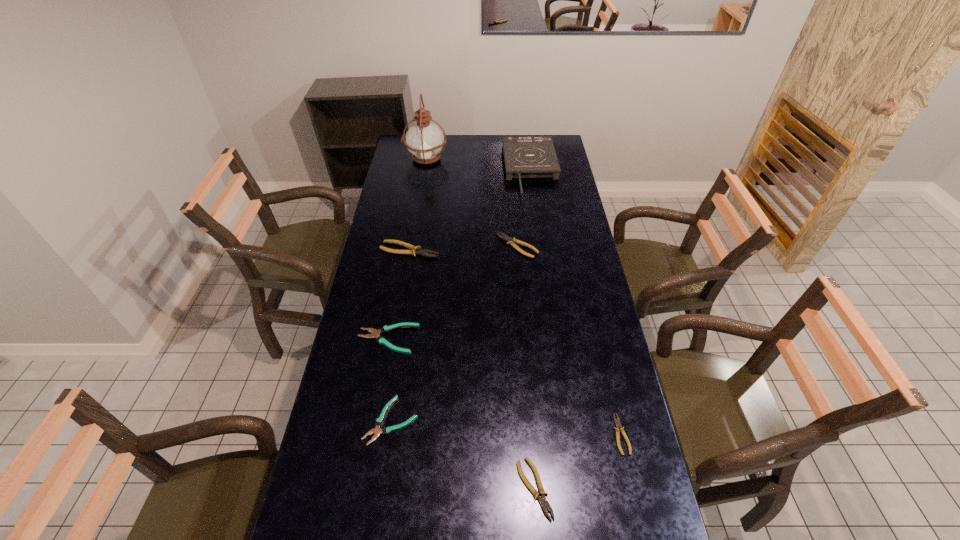
Locate an element on the screen. The width and height of the screenshot is (960, 540). vacant area that lies between the second tallest object and the fifth shortest object is located at coordinates (524, 208).

This screenshot has height=540, width=960. Find the location of `free space between the second nearest yellow pliers and the tallest pliers`. free space between the second nearest yellow pliers and the tallest pliers is located at coordinates (516, 342).

Locate an element on the screen. The width and height of the screenshot is (960, 540). empty space that is in between the rightmost yellow pliers and the leftmost yellow pliers is located at coordinates (516, 342).

I want to click on blank region between the rightmost pliers and the second biggest yellow pliers, so [569, 340].

This screenshot has height=540, width=960. What are the coordinates of `free area in between the smaller teal pliers and the hotplate` in the screenshot? It's located at (461, 295).

This screenshot has width=960, height=540. What are the coordinates of `free area in between the biggest yellow pliers and the farther teal pliers` in the screenshot? It's located at (398, 294).

Select which object appears as the fifth closest to the fifth shortest object. Please provide its 2D coordinates. Your answer should be formatted as a tuple, i.e. [(x, y)], where the tuple contains the x and y coordinates of a point satisfying the conditions above.

[(377, 430)]

Image resolution: width=960 pixels, height=540 pixels. I want to click on object identified as the sixth closest to the bigger teal pliers, so click(x=525, y=157).

Find the location of `pliers object that ranks as the fourth closest to the fifth farthest object`. pliers object that ranks as the fourth closest to the fifth farthest object is located at coordinates (542, 500).

In order to click on pliers that is the nearest to the nearest object in this screenshot , I will do `click(617, 422)`.